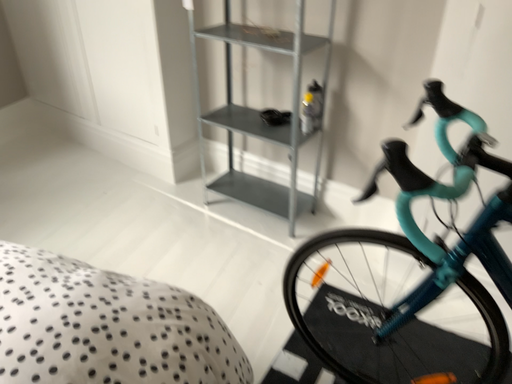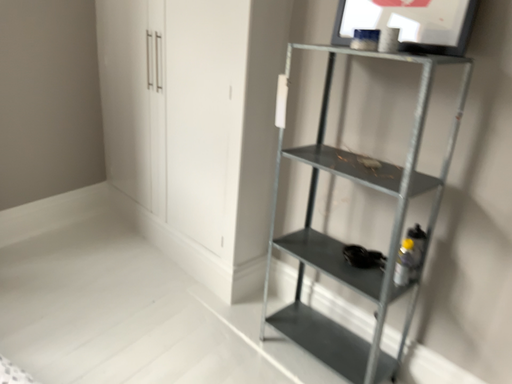
Question: Which way did the camera rotate in the video?

Choices:
 (A) rotated upward
 (B) rotated downward

Answer: (A)